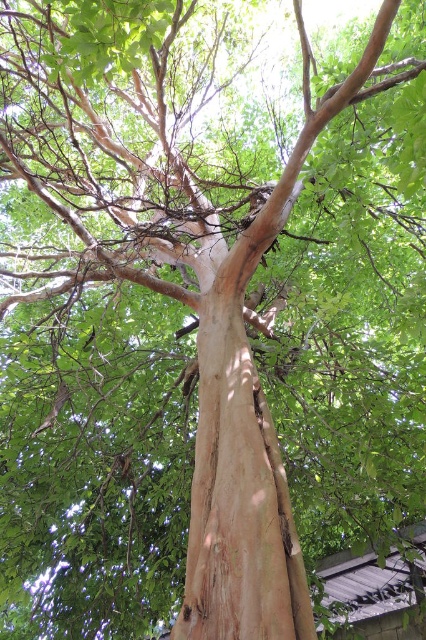
Which is below, smooth bark branch at center or light brown rough bark at center?

light brown rough bark at center is lower down.

Who is positioned more to the right, smooth bark branch at center or light brown rough bark at center?

light brown rough bark at center is more to the right.

Find the location of `smooth bark branch at center`. smooth bark branch at center is located at coordinates (152, 152).